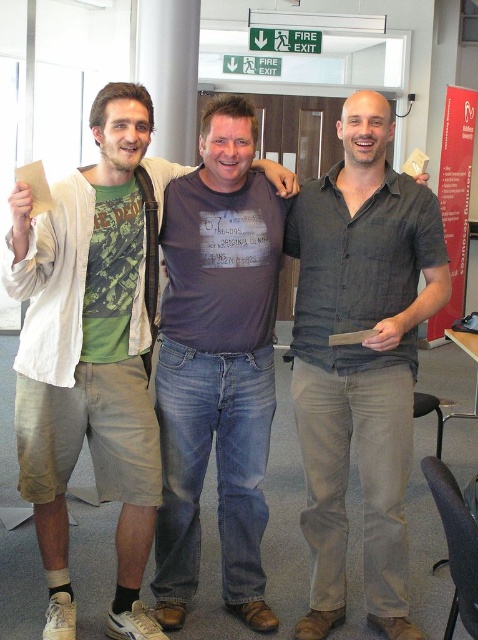
Does green camouflage t-shirt at left come in front of red cardboard sign at right?

Yes.

This screenshot has width=478, height=640. What do you see at coordinates (93, 349) in the screenshot? I see `green camouflage t-shirt at left` at bounding box center [93, 349].

Identify the location of green camouflage t-shirt at left. Image resolution: width=478 pixels, height=640 pixels. (93, 349).

Find the location of a particular element. This screenshot has width=478, height=640. gray linen shirt at center is located at coordinates (360, 358).

Can you confirm if gray linen shirt at center is taller than dark gray cotton t-shirt at center?

Yes, gray linen shirt at center is taller than dark gray cotton t-shirt at center.

Locate an element on the screen. The height and width of the screenshot is (640, 478). gray linen shirt at center is located at coordinates (360, 358).

Who is higher up, dark gray cotton t-shirt at center or red cardboard sign at right?

red cardboard sign at right

Between point (182, 545) and point (447, 314), which one is positioned behind?

Point (447, 314)

This screenshot has height=640, width=478. I want to click on dark gray cotton t-shirt at center, so click(x=217, y=362).